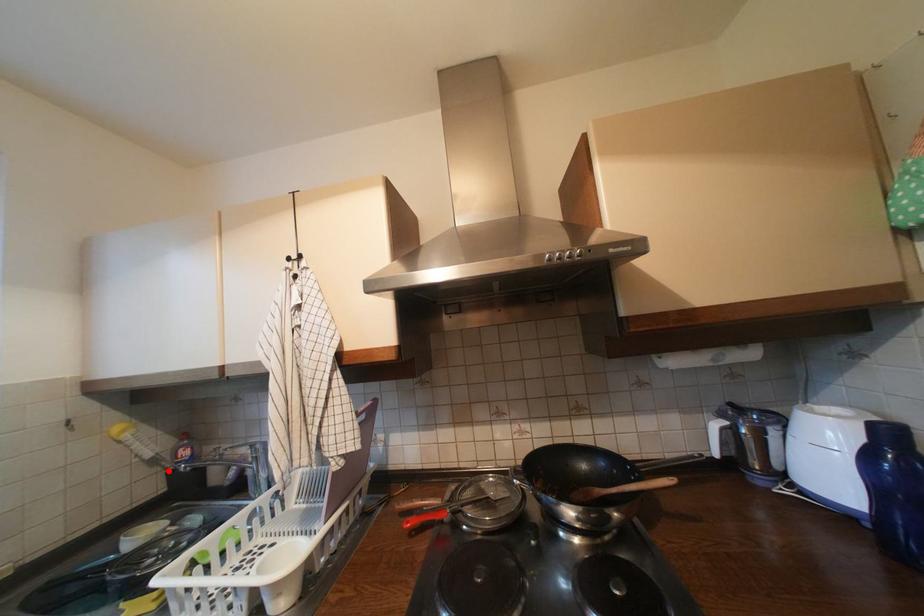
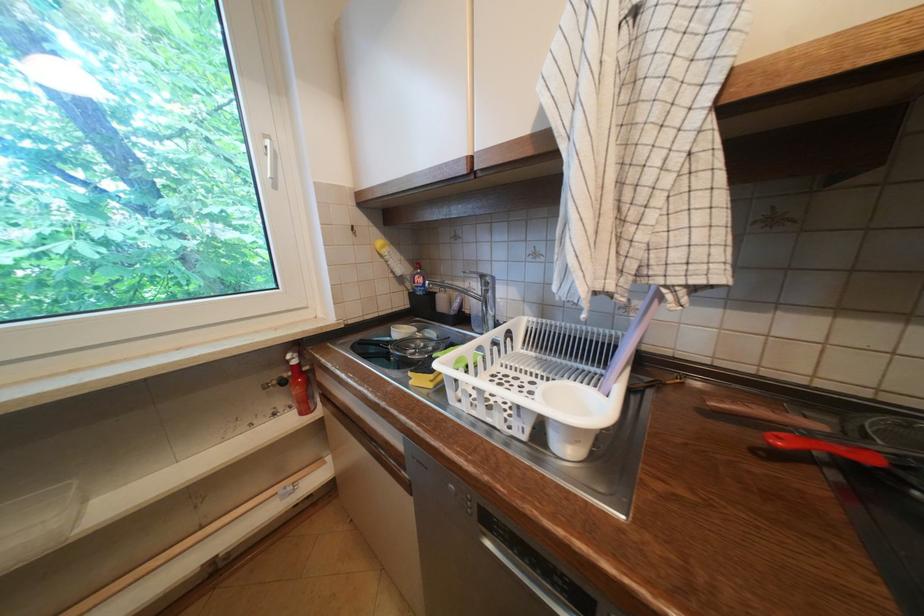
Locate, in the second image, the point that corresponds to the highlighted location in the first image.

(412, 291)